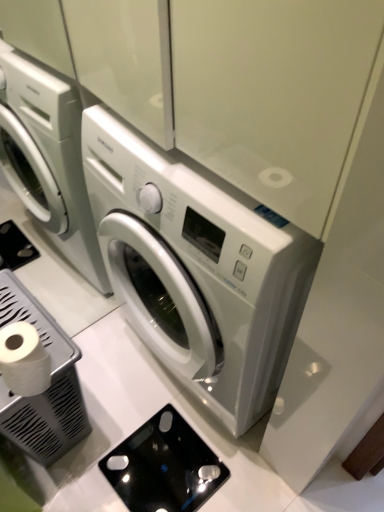
Question: From a real-world perspective, is white plastic trash can at lower left, which is counted as the first appliance, starting from the left, below white matte toilet paper at lower left?

Choices:
 (A) no
 (B) yes

Answer: (B)

Question: Is white plastic trash can at lower left, which ranks as the 2th appliance in right-to-left order, positioned beyond the bounds of white matte toilet paper at lower left?

Choices:
 (A) no
 (B) yes

Answer: (B)

Question: From a real-world perspective, is white plastic trash can at lower left, which is counted as the first appliance, starting from the left, over white matte toilet paper at lower left?

Choices:
 (A) no
 (B) yes

Answer: (A)

Question: Considering the relative sizes of white plastic trash can at lower left, which ranks as the 2th appliance in right-to-left order, and white matte toilet paper at lower left in the image provided, is white plastic trash can at lower left, which ranks as the 2th appliance in right-to-left order, taller than white matte toilet paper at lower left?

Choices:
 (A) no
 (B) yes

Answer: (B)

Question: Does white plastic trash can at lower left, which ranks as the 2th appliance in right-to-left order, have a lesser width compared to white matte toilet paper at lower left?

Choices:
 (A) no
 (B) yes

Answer: (A)

Question: From the image's perspective, would you say white plastic trash can at lower left, which is counted as the first appliance, starting from the left, is shown under white matte toilet paper at lower left?

Choices:
 (A) no
 (B) yes

Answer: (B)

Question: Considering the relative positions of black glass scale at lower center, acting as the 2th appliance starting from the left, and white plastic trash can at lower left, which is counted as the first appliance, starting from the left, in the image provided, is black glass scale at lower center, acting as the 2th appliance starting from the left, behind white plastic trash can at lower left, which is counted as the first appliance, starting from the left,?

Choices:
 (A) yes
 (B) no

Answer: (A)

Question: Is black glass scale at lower center, which is the first appliance in right-to-left order, oriented away from white plastic trash can at lower left, which ranks as the 2th appliance in right-to-left order?

Choices:
 (A) no
 (B) yes

Answer: (A)

Question: Does black glass scale at lower center, which is the first appliance in right-to-left order, appear on the right side of white plastic trash can at lower left, which ranks as the 2th appliance in right-to-left order?

Choices:
 (A) yes
 (B) no

Answer: (A)

Question: Is black glass scale at lower center, which is the first appliance in right-to-left order, not inside white plastic trash can at lower left, which ranks as the 2th appliance in right-to-left order?

Choices:
 (A) no
 (B) yes

Answer: (B)

Question: Considering the relative positions of black glass scale at lower center, which is the first appliance in right-to-left order, and white plastic trash can at lower left, which ranks as the 2th appliance in right-to-left order, in the image provided, is black glass scale at lower center, which is the first appliance in right-to-left order, to the left of white plastic trash can at lower left, which ranks as the 2th appliance in right-to-left order, from the viewer's perspective?

Choices:
 (A) yes
 (B) no

Answer: (B)

Question: Are black glass scale at lower center, acting as the 2th appliance starting from the left, and white plastic trash can at lower left, which ranks as the 2th appliance in right-to-left order, beside each other?

Choices:
 (A) no
 (B) yes

Answer: (A)

Question: From a real-world perspective, does white matte toilet paper at lower left sit lower than white plastic trash can at lower left, which is counted as the first appliance, starting from the left?

Choices:
 (A) yes
 (B) no

Answer: (B)